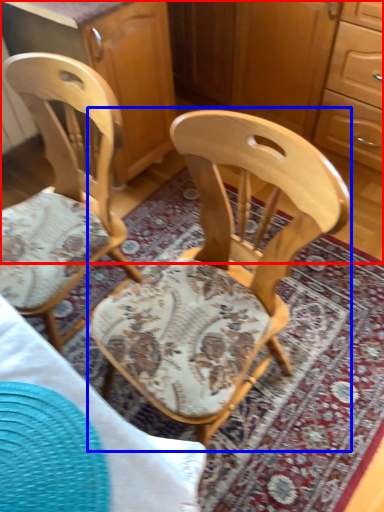
Question: Which of the following is the farthest to the observer, dresser (highlighted by a red box) or chair (highlighted by a blue box)?

Choices:
 (A) dresser
 (B) chair

Answer: (A)